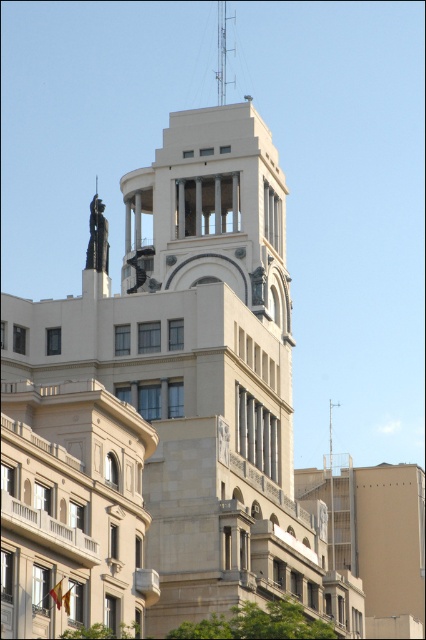
Based on the provided scene description, what is the exact coordinate of the metallic spire at upper center?

The metallic spire at upper center is located at coordinate point [222,52].

You are an architect analyzing the building facade. You notice the polished bronze statue at upper center and the metallic spire at upper center. Which object is positioned to the left when viewed from the front?

The polished bronze statue at upper center is to the left of the metallic spire at upper center, so it is positioned to the left when viewed from the front.